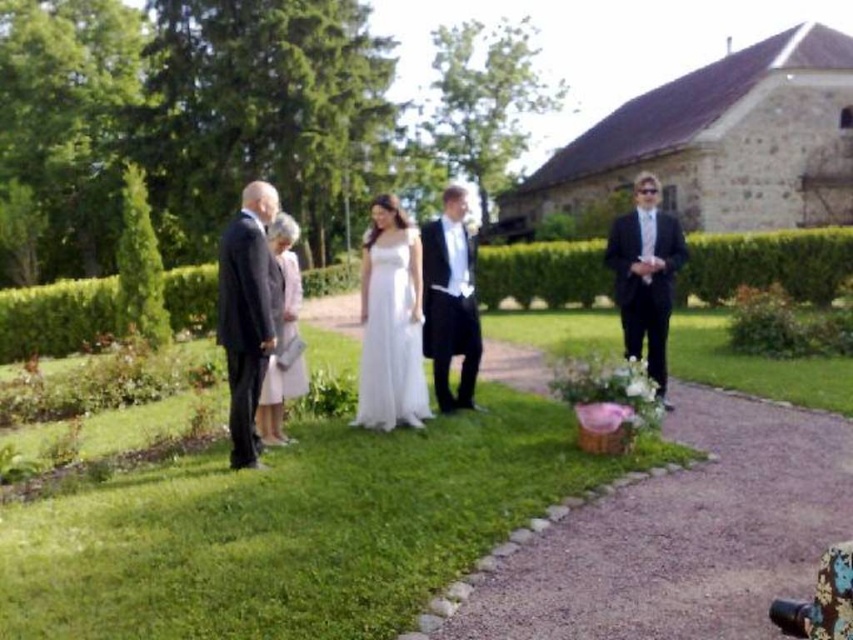
You are a photographer at the wedding and want to take a photo that includes both the couple and the stone building in the background. You notice two points marked in the image. The first point is at coordinate point (556, 412) and the second is at point (461, 204). Which point should you focus on to ensure the couple and the building are both in focus?

You should focus on point (461, 204) because it is closer to the background stone building than point (556, 412), which is closer to the couple. This will help ensure both the couple and the building are in focus.

In the scene shown: You are a photographer at the wedding and want to capture a photo of the matte black suit at right and the shiny black suit at center. Which one is positioned higher in the frame?

The matte black suit at right is located above the shiny black suit at center, so it is positioned higher in the frame.

You are a photographer at the wedding and want to capture a closeup shot of the couple. You are currently standing at the point marked as point (x=294, y=529). Which direction should you move to get closer to the couple?

The point (x=294, y=529) corresponds to green grass at center. To get closer to the couple, you should move away from the green grass at center towards their location.